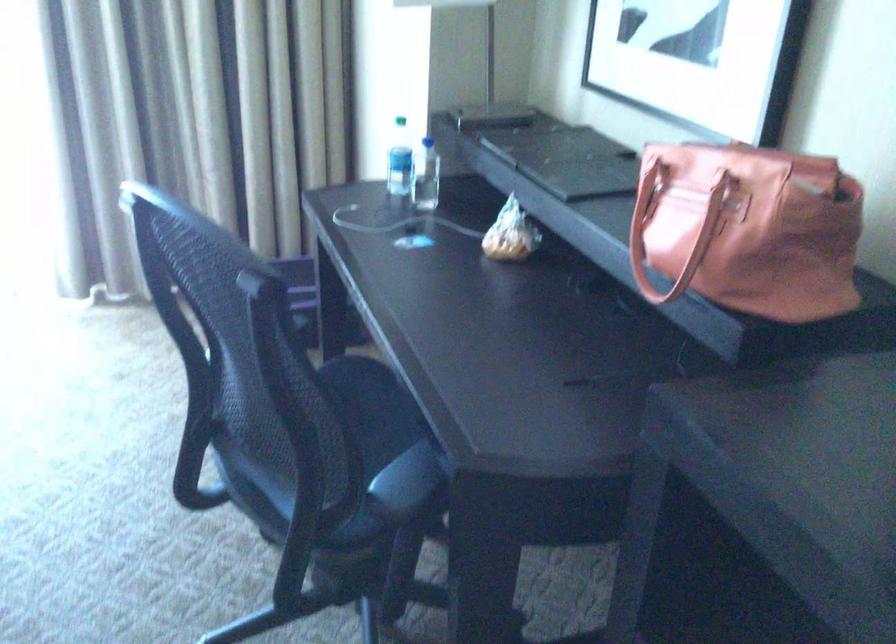
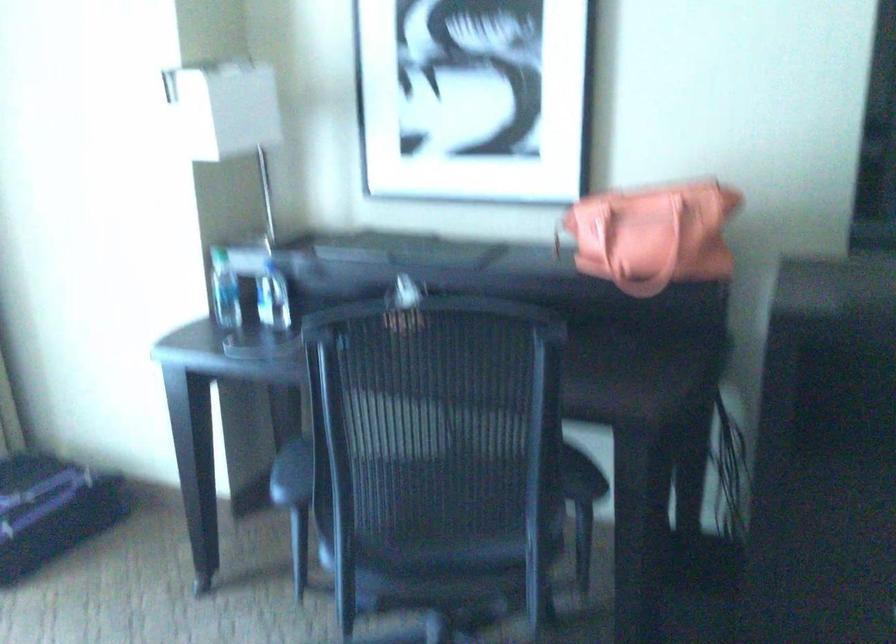
Find the pixel in the second image that matches (394,162) in the first image.

(225, 290)